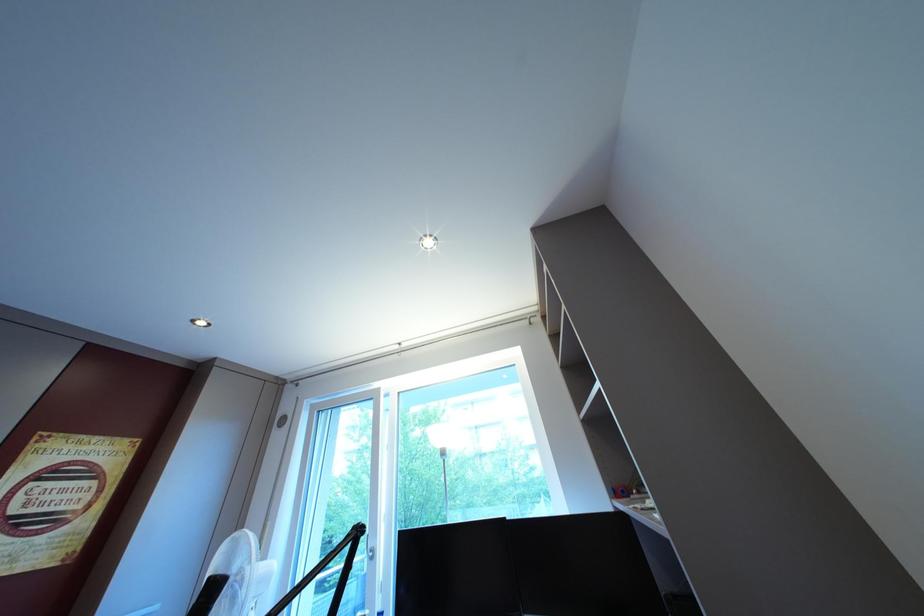
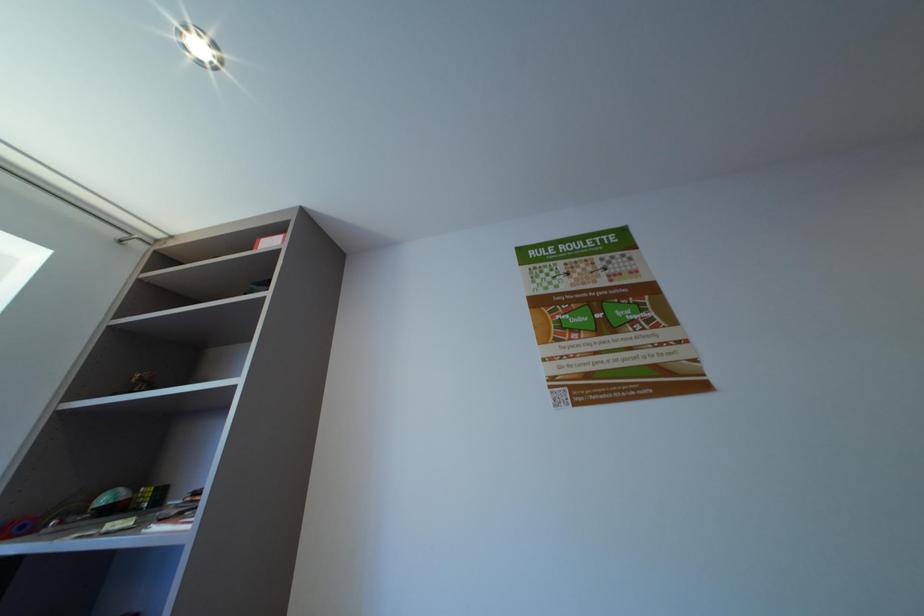
Based on the continuous images, in which direction is the camera rotating?

The camera's rotation is toward right-up.